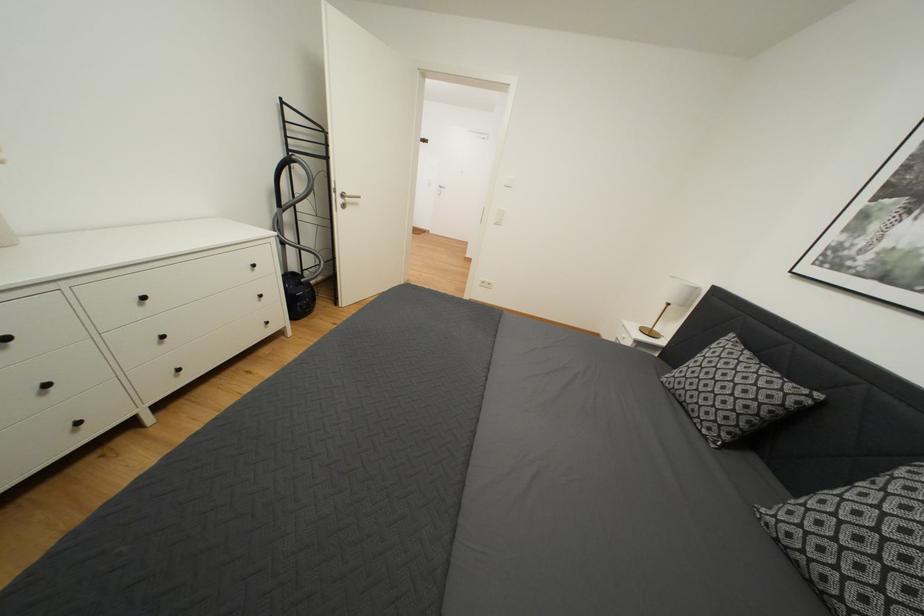
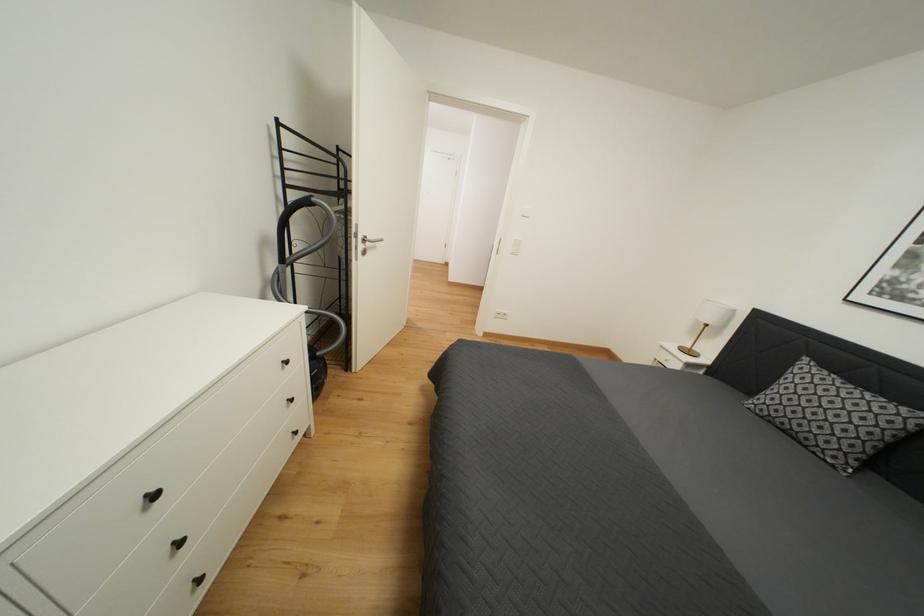
In a continuous first-person perspective shot, in which direction is the camera moving?

The cameraman moved toward left, forward.